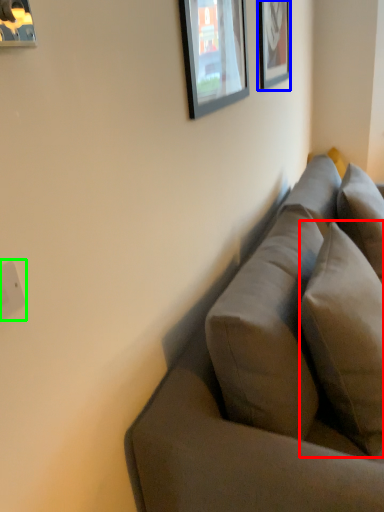
Question: Which object is positioned farthest from pillow (highlighted by a red box)? Select from picture frame (highlighted by a blue box) and electric outlet (highlighted by a green box).

Choices:
 (A) picture frame
 (B) electric outlet

Answer: (A)